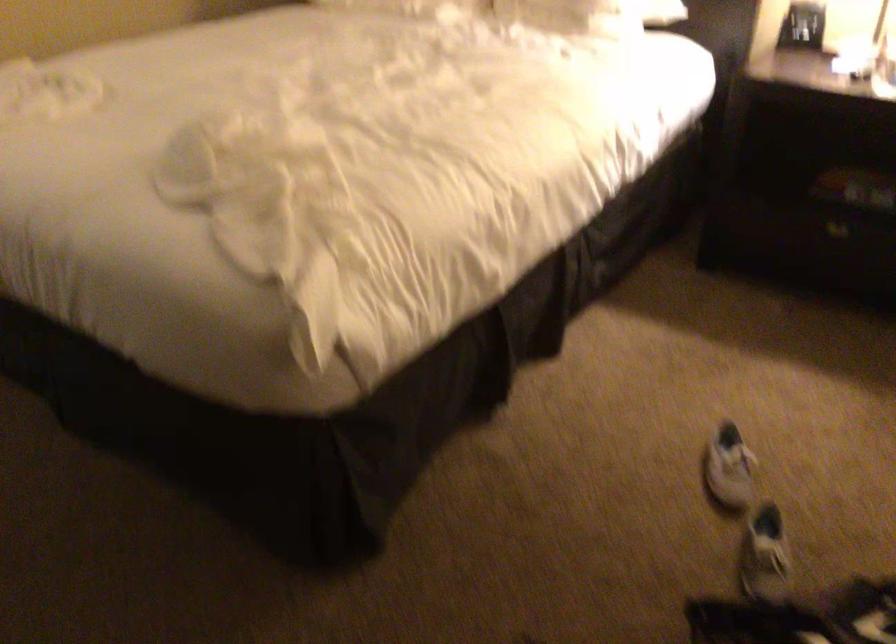
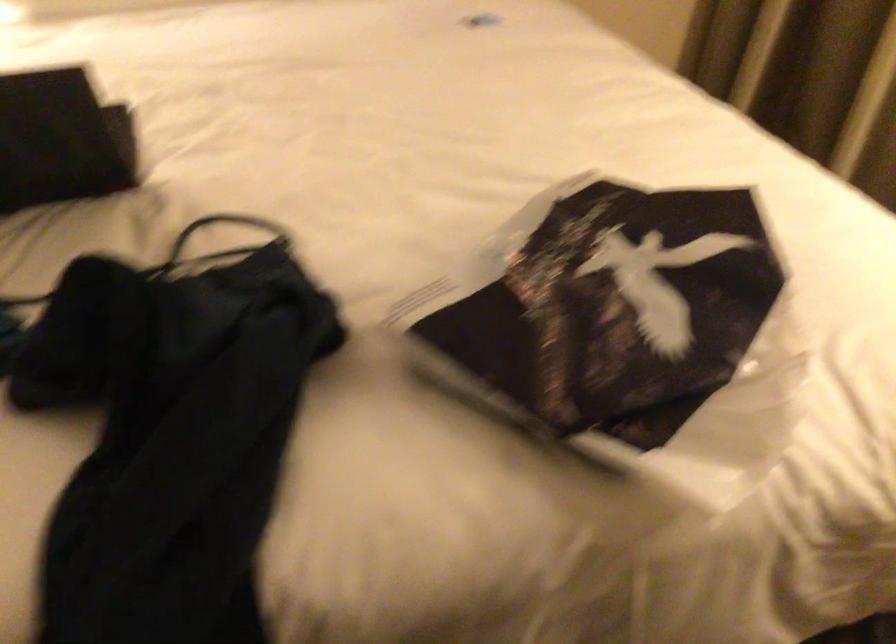
Question: The camera is either moving clockwise (left) or counter-clockwise (right) around the object. The first image is from the beginning of the video and the second image is from the end. Is the camera moving left or right when shooting the video?

Choices:
 (A) Left
 (B) Right

Answer: (A)